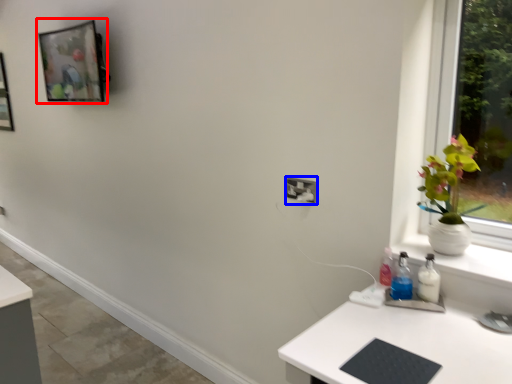
Question: Which object appears farthest to the camera in this image, picture frame (highlighted by a red box) or electric outlet (highlighted by a blue box)?

Choices:
 (A) picture frame
 (B) electric outlet

Answer: (A)